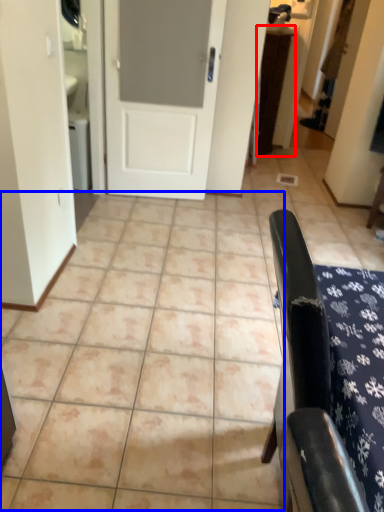
Question: Which object appears closest to the camera in this image, table (highlighted by a red box) or ceramic tile (highlighted by a blue box)?

Choices:
 (A) table
 (B) ceramic tile

Answer: (B)